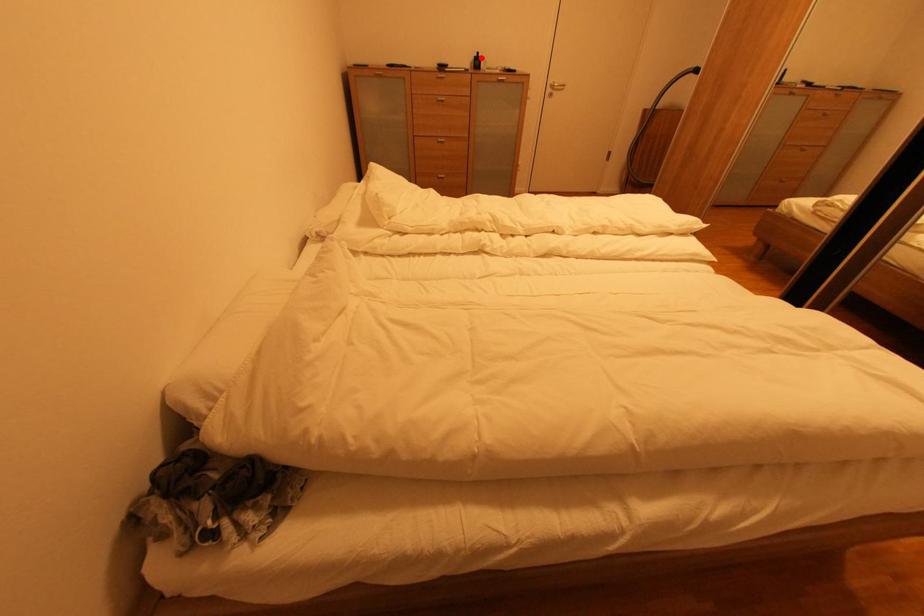
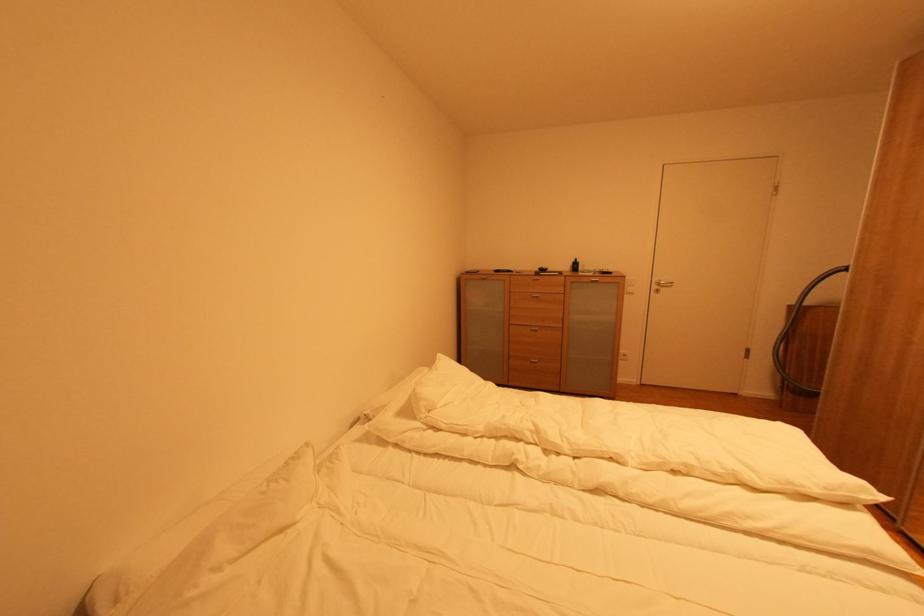
Where in the second image is the point corresponding to the highlighted location from the first image?

(578, 264)